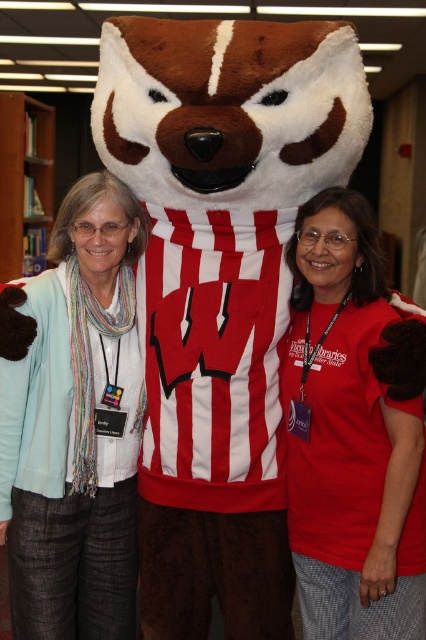
Who is taller, matte red shirt at center or wooden bookshelf at left?

With more height is matte red shirt at center.

Can you confirm if matte red shirt at center is taller than wooden bookshelf at left?

Indeed, matte red shirt at center has a greater height compared to wooden bookshelf at left.

Is point (373, 262) positioned in front of point (28, 116)?

Yes, point (373, 262) is in front of point (28, 116).

Where is `matte red shirt at center`? matte red shirt at center is located at coordinates (353, 429).

Which of these two, matte red shirt at center or light blue cardigan at left, stands taller?

light blue cardigan at left is taller.

Between point (391, 512) and point (123, 572), which one is positioned in front?

Point (391, 512) is in front.

Identify the location of matte red shirt at center. pyautogui.click(x=353, y=429).

Who is lower down, light blue cardigan at left or wooden bookshelf at left?

light blue cardigan at left

Image resolution: width=426 pixels, height=640 pixels. Describe the element at coordinates (75, 426) in the screenshot. I see `light blue cardigan at left` at that location.

Image resolution: width=426 pixels, height=640 pixels. In order to click on light blue cardigan at left in this screenshot , I will do `click(75, 426)`.